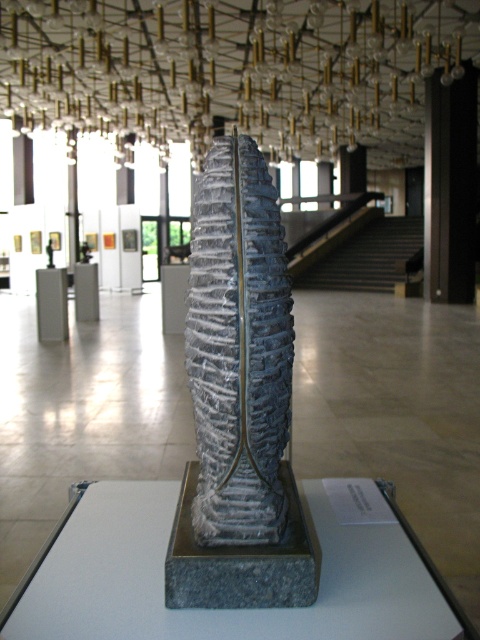
Can you confirm if gray textured stone column at center is positioned to the left of gray stone pillar at center?

Incorrect, gray textured stone column at center is not on the left side of gray stone pillar at center.

Between gray textured stone column at center and gray stone pillar at center, which one is positioned higher?

gray stone pillar at center

This screenshot has width=480, height=640. What are the coordinates of `gray textured stone column at center` in the screenshot? It's located at (239, 401).

This screenshot has height=640, width=480. Describe the element at coordinates (450, 186) in the screenshot. I see `black polished pillar at right` at that location.

Does black polished pillar at right have a lesser width compared to gray stone pillar at center?

No.

Who is more forward, (441, 276) or (57, 273)?

Point (57, 273) is in front.

Where is `black polished pillar at right`? This screenshot has height=640, width=480. black polished pillar at right is located at coordinates (450, 186).

Does gray textured stone column at center have a greater width compared to black polished pillar at right?

In fact, gray textured stone column at center might be narrower than black polished pillar at right.

Who is shorter, gray textured stone column at center or black polished pillar at right?

Standing shorter between the two is gray textured stone column at center.

Locate an element on the screen. This screenshot has height=640, width=480. gray textured stone column at center is located at coordinates (239, 401).

What are the coordinates of `gray textured stone column at center` in the screenshot? It's located at (239, 401).